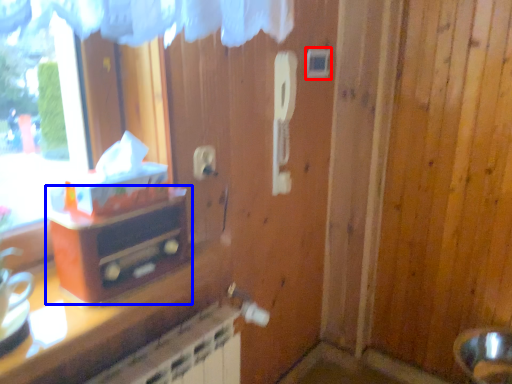
Question: Which point is further to the camera, light switch (highlighted by a red box) or furniture (highlighted by a blue box)?

Choices:
 (A) light switch
 (B) furniture

Answer: (A)